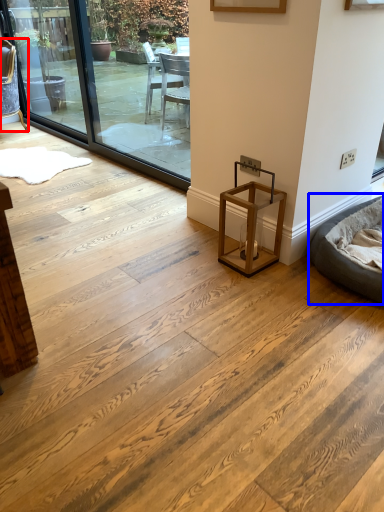
Question: Among these objects, which one is nearest to the camera, chair (highlighted by a red box) or bean bag chair (highlighted by a blue box)?

Choices:
 (A) chair
 (B) bean bag chair

Answer: (B)